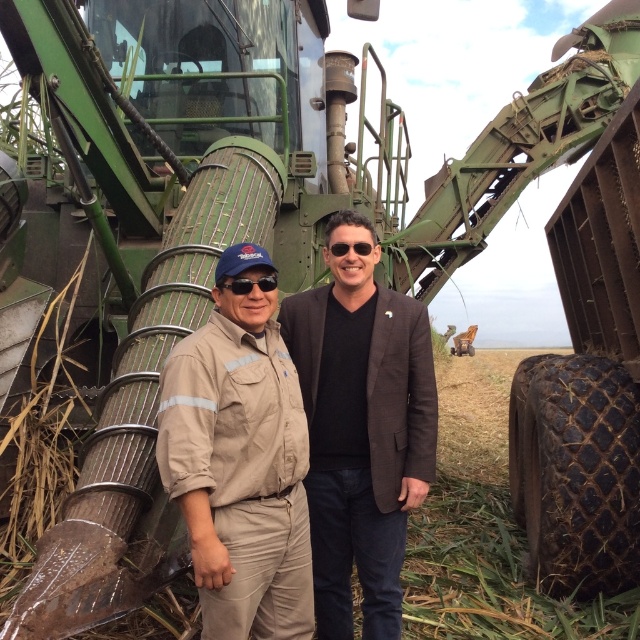
Question: Which object appears farthest from the camera in this image?

Choices:
 (A) tan fabric uniform at center
 (B) black matte sunglasses at center
 (C) brown fabric suit at center

Answer: (C)

Question: Does brown fabric suit at center appear on the right side of black matte sunglasses at center?

Choices:
 (A) yes
 (B) no

Answer: (A)

Question: Is tan fabric uniform at center to the right of black matte sunglasses at center from the viewer's perspective?

Choices:
 (A) no
 (B) yes

Answer: (A)

Question: Among these objects, which one is nearest to the camera?

Choices:
 (A) black matte sunglasses at center
 (B) brown fabric suit at center
 (C) tan fabric uniform at center

Answer: (C)

Question: Does brown fabric suit at center appear on the right side of black matte sunglasses at center?

Choices:
 (A) no
 (B) yes

Answer: (B)

Question: Which of the following is the closest to the observer?

Choices:
 (A) (241, 292)
 (B) (244, 348)

Answer: (A)